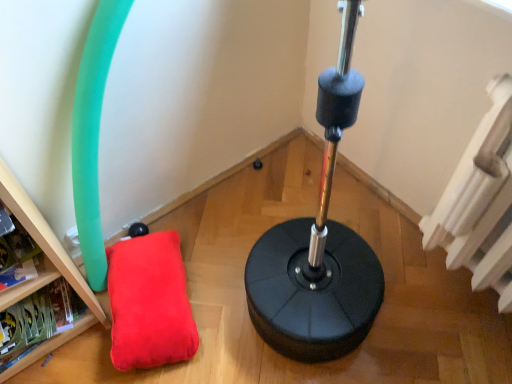
Question: From a real-world perspective, is white textured radiator at upper right physically above wooden bookshelf at lower left?

Choices:
 (A) yes
 (B) no

Answer: (A)

Question: From the image's perspective, is white textured radiator at upper right over wooden bookshelf at lower left?

Choices:
 (A) no
 (B) yes

Answer: (B)

Question: Is white textured radiator at upper right outside wooden bookshelf at lower left?

Choices:
 (A) no
 (B) yes

Answer: (B)

Question: Is white textured radiator at upper right thinner than wooden bookshelf at lower left?

Choices:
 (A) no
 (B) yes

Answer: (B)

Question: Is white textured radiator at upper right not close to wooden bookshelf at lower left?

Choices:
 (A) no
 (B) yes

Answer: (A)

Question: Is white textured radiator at upper right in front of or behind velvet red pillow at lower left in the image?

Choices:
 (A) behind
 (B) front

Answer: (B)

Question: From the image's perspective, relative to velvet red pillow at lower left, is white textured radiator at upper right above or below?

Choices:
 (A) above
 (B) below

Answer: (A)

Question: Is white textured radiator at upper right situated inside velvet red pillow at lower left or outside?

Choices:
 (A) outside
 (B) inside

Answer: (A)

Question: Considering the positions of white textured radiator at upper right and velvet red pillow at lower left in the image, is white textured radiator at upper right bigger or smaller than velvet red pillow at lower left?

Choices:
 (A) big
 (B) small

Answer: (A)

Question: Considering the positions of point (110, 258) and point (503, 269), is point (110, 258) closer or farther from the camera than point (503, 269)?

Choices:
 (A) farther
 (B) closer

Answer: (A)

Question: From the image's perspective, is velvet red pillow at lower left above or below white textured radiator at upper right?

Choices:
 (A) above
 (B) below

Answer: (B)

Question: Do you think velvet red pillow at lower left is within white textured radiator at upper right, or outside of it?

Choices:
 (A) outside
 (B) inside

Answer: (A)

Question: Relative to white textured radiator at upper right, is velvet red pillow at lower left in front or behind?

Choices:
 (A) behind
 (B) front

Answer: (A)

Question: Is white textured radiator at upper right bigger or smaller than wooden bookshelf at lower left?

Choices:
 (A) small
 (B) big

Answer: (B)

Question: In the image, is white textured radiator at upper right positioned in front of or behind wooden bookshelf at lower left?

Choices:
 (A) behind
 (B) front

Answer: (B)